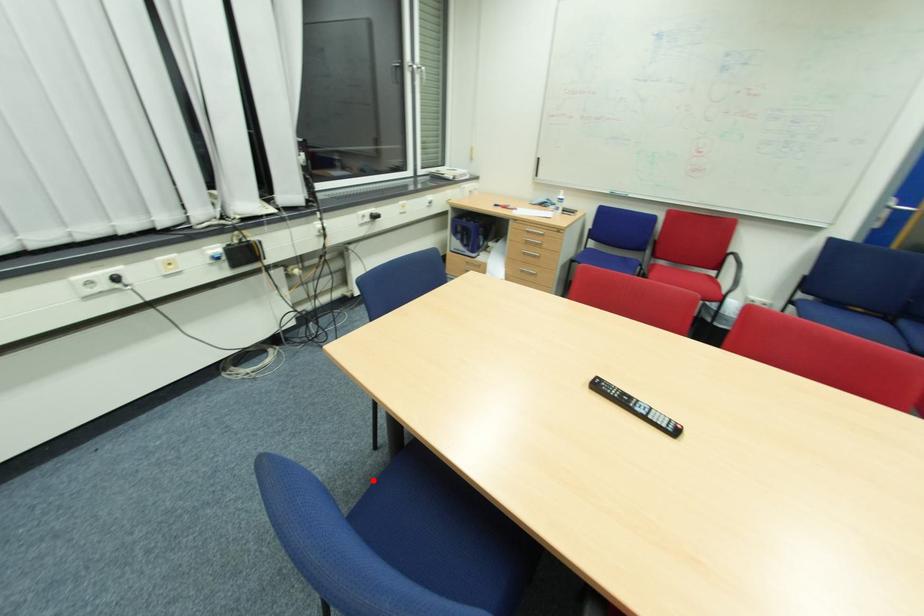
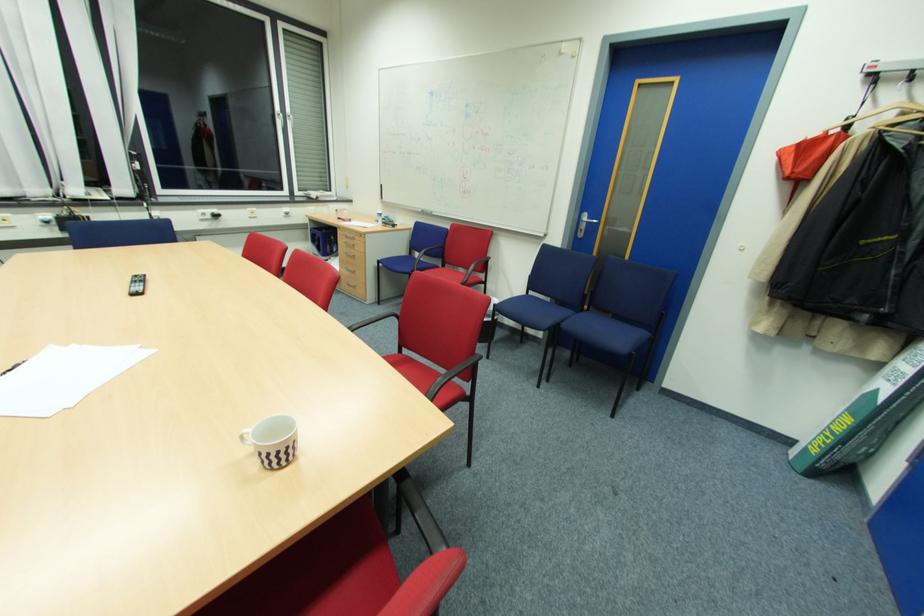
Question: I am providing you with two images of the same scene from different viewpoints. A red point is marked on the first image. Can you still see the location of the red point in image 2?

Choices:
 (A) Yes
 (B) No

Answer: (B)